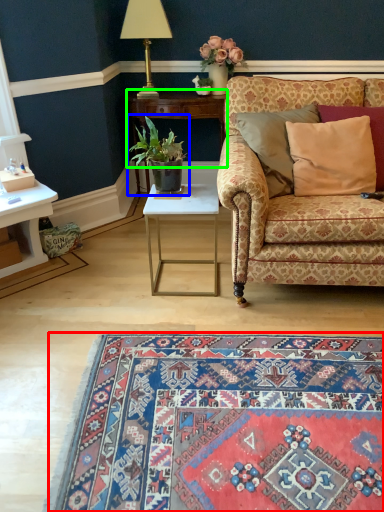
Question: Which is nearer to the mat (highlighted by a red box)? houseplant (highlighted by a blue box) or table (highlighted by a green box).

Choices:
 (A) houseplant
 (B) table

Answer: (A)